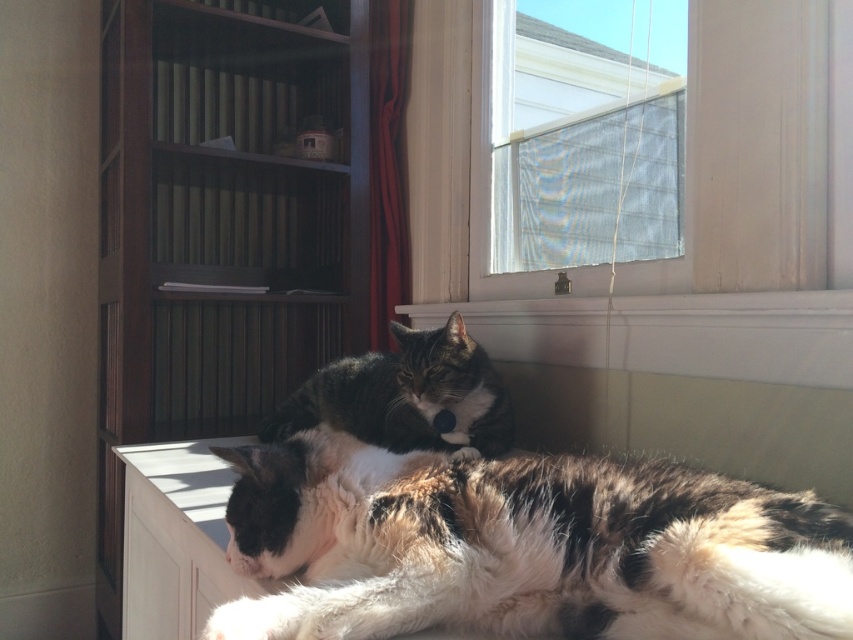
Question: Is calico fur cat at lower center to the right of velvet-like red curtain at center from the viewer's perspective?

Choices:
 (A) yes
 (B) no

Answer: (A)

Question: Which of the following is the farthest from the observer?

Choices:
 (A) tabby fur cat at center
 (B) white textured curtain at upper right
 (C) calico fur cat at lower center
 (D) velvet-like red curtain at center

Answer: (D)

Question: Which of the following is the closest to the observer?

Choices:
 (A) (788, 253)
 (B) (389, 262)

Answer: (A)

Question: Does wooden bookshelf at left have a lesser width compared to translucent fabric at upper center?

Choices:
 (A) no
 (B) yes

Answer: (A)

Question: Is white textured curtain at upper right below white smooth window sill at center?

Choices:
 (A) yes
 (B) no

Answer: (B)

Question: Which point appears closest to the camera in this image?

Choices:
 (A) (479, 419)
 (B) (374, 132)
 (C) (604, 244)
 (D) (115, 352)

Answer: (A)